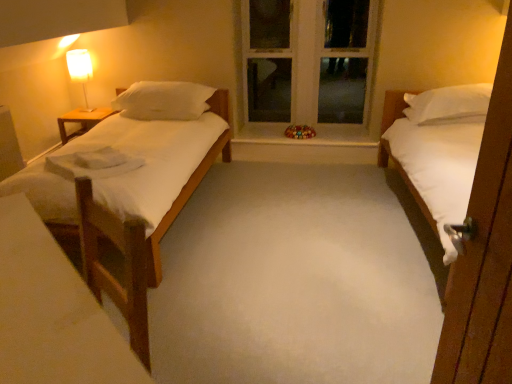
Image resolution: width=512 pixels, height=384 pixels. What do you see at coordinates (164, 101) in the screenshot? I see `white soft pillow at left` at bounding box center [164, 101].

At what (x,y) coordinates should I click in order to perform the action: click on white matte bed at right. Please return your answer as a coordinate pair (x, y). The image size is (512, 384). Looking at the image, I should click on (440, 149).

The image size is (512, 384). What do you see at coordinates (440, 149) in the screenshot? I see `white matte bed at right` at bounding box center [440, 149].

What do you see at coordinates (80, 71) in the screenshot? This screenshot has height=384, width=512. I see `matte white lamp at upper left` at bounding box center [80, 71].

Find the location of `wooden vanity at left`. wooden vanity at left is located at coordinates (52, 312).

Image resolution: width=512 pixels, height=384 pixels. Identify the location of white wood window frame at center. (308, 60).

Considering the sizes of objects smooth glass window sill at center and white soft pillow at left in the image provided, who is wider, smooth glass window sill at center or white soft pillow at left?

smooth glass window sill at center.

Between smooth glass window sill at center and white soft pillow at left, which one has smaller size?

smooth glass window sill at center is smaller.

Is point (353, 133) positioned in front of point (189, 87)?

No.

From a real-world perspective, is smooth glass window sill at center positioned over white soft pillow at left based on gravity?

No, from a real-world perspective, smooth glass window sill at center is not above white soft pillow at left.

Is matte white lamp at upper left looking in the opposite direction of white matte bed at right?

matte white lamp at upper left is not turned away from white matte bed at right.

Which of these two, matte white lamp at upper left or white matte bed at right, is bigger?

white matte bed at right.

From a real-world perspective, which object stands above the other?

In real-world perspective, matte white lamp at upper left is above.

From the image's perspective, is matte white lamp at upper left on top of white matte bed at right?

Yes, from the image's perspective, matte white lamp at upper left is over white matte bed at right.

Does smooth glass window sill at center turn towards wooden vanity at left?

No, smooth glass window sill at center is not oriented towards wooden vanity at left.

What's the angular difference between smooth glass window sill at center and wooden vanity at left's facing directions?

The angle between the facing direction of smooth glass window sill at center and the facing direction of wooden vanity at left is 42.1 degrees.

Is smooth glass window sill at center in front of or behind wooden vanity at left in the image?

In the image, smooth glass window sill at center appears behind wooden vanity at left.

Measure the distance between smooth glass window sill at center and wooden vanity at left.

A distance of 3.30 meters exists between smooth glass window sill at center and wooden vanity at left.

From a real-world perspective, between white soft pillow at left and wooden vanity at left, who is vertically lower?

wooden vanity at left.

Who is smaller, white soft pillow at left or wooden vanity at left?

Smaller between the two is wooden vanity at left.

The image size is (512, 384). I want to click on vanity on the right of white soft pillow at left, so click(52, 312).

Is white soft pillow at left touching wooden vanity at left?

No, white soft pillow at left is not in contact with wooden vanity at left.

Which object is further away from the camera, white wood window frame at center or wooden table at left?

white wood window frame at center.

Between white wood window frame at center and wooden table at left, which one appears on the left side from the viewer's perspective?

Result: wooden table at left is more to the left.

Who is smaller, white wood window frame at center or wooden table at left?

wooden table at left is smaller.

Does point (316, 21) lie behind point (67, 120)?

Yes.

Considering the points (483, 120) and (340, 22), which point is in front, point (483, 120) or point (340, 22)?

Positioned in front is point (483, 120).

Locate an element on the screen. This screenshot has width=512, height=384. bed below the white wood window frame at center (from the image's perspective) is located at coordinates (440, 149).

From the image's perspective, which one is positioned higher, white matte bed at right or white wood window frame at center?

white wood window frame at center.

Visually, is smooth glass window sill at center positioned to the left or to the right of white wood window frame at center?

smooth glass window sill at center is positioned on white wood window frame at center's left side.

This screenshot has width=512, height=384. I want to click on window sill behind the white wood window frame at center, so click(306, 139).

Is point (254, 125) more distant than point (259, 50)?

Yes, it is behind point (259, 50).

Is smooth glass window sill at center smaller than white wood window frame at center?

Yes.

What are the coordinates of `pillow located above the smooth glass window sill at center (from the image's perspective)` in the screenshot? It's located at (164, 101).

The width and height of the screenshot is (512, 384). Find the location of `bed below the matte white lamp at upper left (from a real-world perspective)`. bed below the matte white lamp at upper left (from a real-world perspective) is located at coordinates (440, 149).

When comparing their distances from white matte bed at right, does white wood window frame at center or white soft pillow at left seem further?

Based on the image, white soft pillow at left appears to be further to white matte bed at right.

Looking at this image, estimate the real-world distances between objects in this image. Which object is further from matte white lamp at upper left, wooden vanity at left or white matte bed at right?

wooden vanity at left.

Estimate the real-world distances between objects in this image. Which object is closer to smooth glass window sill at center, wooden table at left or wooden vanity at left?

The object closer to smooth glass window sill at center is wooden table at left.

Looking at the image, which one is located closer to matte white lamp at upper left, white soft pillow at left or white wood window frame at center?

Among the two, white soft pillow at left is located nearer to matte white lamp at upper left.

Considering their positions, is white wood window frame at center positioned further to white matte bed at right than smooth glass window sill at center?

white wood window frame at center lies further to white matte bed at right than the other object.

Estimate the real-world distances between objects in this image. Which object is closer to white wood window frame at center, white soft pillow at left or white matte bed at right?

Result: white soft pillow at left is closer to white wood window frame at center.

Based on their spatial positions, is matte white lamp at upper left or white soft pillow at left closer to wooden vanity at left?

Among the two, white soft pillow at left is located nearer to wooden vanity at left.

Looking at this image, considering their positions, is smooth glass window sill at center positioned further to white wood window frame at center than matte white lamp at upper left?

Among the two, matte white lamp at upper left is located further to white wood window frame at center.

Image resolution: width=512 pixels, height=384 pixels. I want to click on window sill located between matte white lamp at upper left and white matte bed at right in the left-right direction, so click(306, 139).

Identify the location of vanity between white soft pillow at left and white matte bed at right from left to right. The image size is (512, 384). (52, 312).

At what (x,y) coordinates should I click in order to perform the action: click on bedside lamp between wooden vanity at left and smooth glass window sill at center along the z-axis. Please return your answer as a coordinate pair (x, y). The height and width of the screenshot is (384, 512). Looking at the image, I should click on coord(80,71).

Where is `bedside lamp located between wooden vanity at left and white wood window frame at center in the depth direction`? This screenshot has height=384, width=512. bedside lamp located between wooden vanity at left and white wood window frame at center in the depth direction is located at coordinates (80, 71).